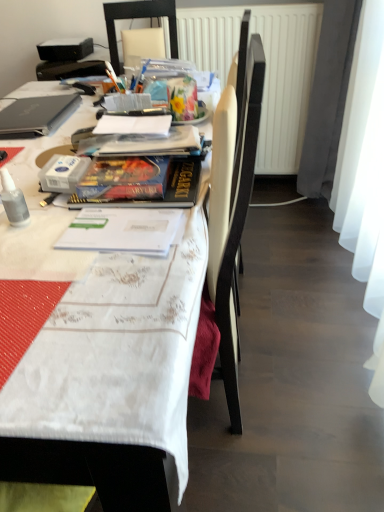
Question: Should I look upward or downward to see white textured radiator at upper center?

Choices:
 (A) up
 (B) down

Answer: (A)

Question: From a real-world perspective, is hardcover book at center positioned under transparent plastic bottle at left based on gravity?

Choices:
 (A) no
 (B) yes

Answer: (B)

Question: Is hardcover book at center facing towards transparent plastic bottle at left?

Choices:
 (A) yes
 (B) no

Answer: (B)

Question: Is hardcover book at center not inside transparent plastic bottle at left?

Choices:
 (A) yes
 (B) no

Answer: (A)

Question: From a real-world perspective, is hardcover book at center on top of transparent plastic bottle at left?

Choices:
 (A) no
 (B) yes

Answer: (A)

Question: Does hardcover book at center contain transparent plastic bottle at left?

Choices:
 (A) no
 (B) yes

Answer: (A)

Question: Does hardcover book at center have a smaller size compared to transparent plastic bottle at left?

Choices:
 (A) yes
 (B) no

Answer: (B)

Question: Is transparent plastic bottle at left placed right next to white plastic chair at upper center?

Choices:
 (A) yes
 (B) no

Answer: (B)

Question: Is transparent plastic bottle at left thinner than white plastic chair at upper center?

Choices:
 (A) yes
 (B) no

Answer: (A)

Question: Can you confirm if transparent plastic bottle at left is smaller than white plastic chair at upper center?

Choices:
 (A) no
 (B) yes

Answer: (B)

Question: From a real-world perspective, is transparent plastic bottle at left over white plastic chair at upper center?

Choices:
 (A) yes
 (B) no

Answer: (B)

Question: Is transparent plastic bottle at left far from white plastic chair at upper center?

Choices:
 (A) yes
 (B) no

Answer: (A)

Question: Does transparent plastic bottle at left appear on the left side of white plastic chair at upper center?

Choices:
 (A) yes
 (B) no

Answer: (A)

Question: Does white fabric table at upper left come behind hardcover book at center?

Choices:
 (A) yes
 (B) no

Answer: (B)